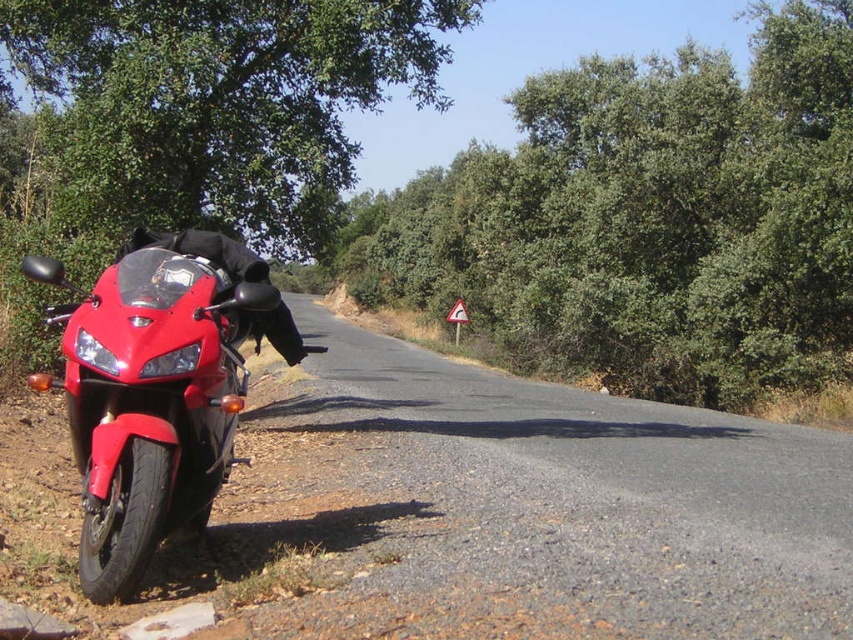
Between point (161, 12) and point (241, 316), which one is positioned behind?

Positioned behind is point (161, 12).

The height and width of the screenshot is (640, 853). What do you see at coordinates (221, 102) in the screenshot?
I see `green leafy tree at upper left` at bounding box center [221, 102].

At what (x,y) coordinates should I click in order to perform the action: click on green leafy tree at upper left. Please return your answer as a coordinate pair (x, y). This screenshot has width=853, height=640. Looking at the image, I should click on (221, 102).

Identify the location of green leafy tree at upper left. This screenshot has width=853, height=640. (221, 102).

Does green leafy tree at center have a greater width compared to green leafy tree at upper left?

Yes, green leafy tree at center is wider than green leafy tree at upper left.

Between green leafy tree at center and green leafy tree at upper left, which one has less height?

green leafy tree at upper left

Consider the image. Who is more forward, (781, 145) or (64, 129)?

Point (64, 129) is more forward.

Where is `green leafy tree at center`? The width and height of the screenshot is (853, 640). green leafy tree at center is located at coordinates (646, 220).

Does green leafy tree at center have a lesser width compared to glossy red motorcycle at left?

No.

Which of these two, green leafy tree at center or glossy red motorcycle at left, stands shorter?

glossy red motorcycle at left is shorter.

This screenshot has height=640, width=853. What are the coordinates of `green leafy tree at center` in the screenshot? It's located at (646, 220).